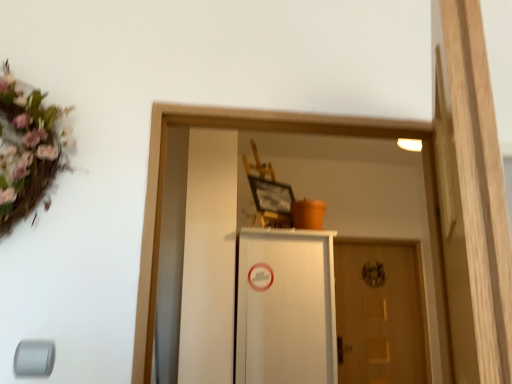
This screenshot has width=512, height=384. What do you see at coordinates (379, 313) in the screenshot?
I see `wooden door at center` at bounding box center [379, 313].

The height and width of the screenshot is (384, 512). What are the coordinates of `wooden door at center` in the screenshot? It's located at (379, 313).

What is the approximate height of wooden door at center?

wooden door at center is 1.24 meters in height.

Find the location of `white matte cabinet at center`. white matte cabinet at center is located at coordinates (286, 307).

What do you see at coordinates (286, 307) in the screenshot?
I see `white matte cabinet at center` at bounding box center [286, 307].

Measure the distance between point (272, 328) and camera.

7.66 feet.

Where is `wooden door at center`? This screenshot has width=512, height=384. wooden door at center is located at coordinates (379, 313).

In the scene shown: Does wooden door at center appear on the left side of white matte cabinet at center?

Incorrect, wooden door at center is not on the left side of white matte cabinet at center.

Between wooden door at center and white matte cabinet at center, which one is positioned in front?

white matte cabinet at center is more forward.

Which is behind, point (380, 362) or point (273, 363)?

The point (380, 362) is more distant.

From the image's perspective, does wooden door at center appear higher than white matte cabinet at center?

No, from the image's perspective, wooden door at center is not over white matte cabinet at center.

From a real-world perspective, relative to white matte cabinet at center, is wooden door at center vertically above or below?

From a real-world perspective, wooden door at center is physically below white matte cabinet at center.

Which object is wider, wooden door at center or white matte cabinet at center?

white matte cabinet at center is wider.

Between wooden door at center and white matte cabinet at center, which one has more height?

With more height is wooden door at center.

Is wooden door at center bigger than white matte cabinet at center?

Actually, wooden door at center might be smaller than white matte cabinet at center.

Is wooden door at center not inside white matte cabinet at center?

Yes, wooden door at center is not within white matte cabinet at center.

Are wooden door at center and white matte cabinet at center far apart?

wooden door at center is far away from white matte cabinet at center.

Is wooden door at center facing away from white matte cabinet at center?

No, wooden door at center is not facing away from white matte cabinet at center.

What's the angular difference between wooden door at center and white matte cabinet at center's facing directions?

They differ by 88 degrees in their facing directions.

Find the location of a particular element. This screenshot has height=384, width=512. cabinetry lying on the left of wooden door at center is located at coordinates (286, 307).

Is white matte cabinet at center at the right side of wooden door at center?

In fact, white matte cabinet at center is to the left of wooden door at center.

Considering the positions of objects white matte cabinet at center and wooden door at center in the image provided, who is in front, white matte cabinet at center or wooden door at center?

white matte cabinet at center is in front.

Which is less distant, (298, 306) or (378, 365)?

Point (298, 306) is closer to the camera than point (378, 365).

From the image's perspective, which one is positioned lower, white matte cabinet at center or wooden door at center?

wooden door at center, from the image's perspective.

From a real-world perspective, which is physically above, white matte cabinet at center or wooden door at center?

From a 3D spatial view, white matte cabinet at center is above.

In the scene shown: Considering the relative sizes of white matte cabinet at center and wooden door at center in the image provided, is white matte cabinet at center thinner than wooden door at center?

No, white matte cabinet at center is not thinner than wooden door at center.

Which of these two, white matte cabinet at center or wooden door at center, stands taller?

With more height is wooden door at center.

Does white matte cabinet at center have a smaller size compared to wooden door at center?

No, white matte cabinet at center is not smaller than wooden door at center.

Is white matte cabinet at center completely or partially outside of wooden door at center?

white matte cabinet at center lies outside wooden door at center's area.

Are white matte cabinet at center and wooden door at center located far from each other?

Yes, white matte cabinet at center is far from wooden door at center.

Is white matte cabinet at center turned away from wooden door at center?

No, white matte cabinet at center's orientation is not away from wooden door at center.

How many degrees apart are the facing directions of white matte cabinet at center and wooden door at center?

88 degrees.

Measure the distance between white matte cabinet at center and wooden door at center.

They are 5.31 feet apart.

This screenshot has width=512, height=384. I want to click on door on the right of white matte cabinet at center, so click(379, 313).

Where is `cabinetry that is above the wooden door at center (from the image's perspective)`? The height and width of the screenshot is (384, 512). cabinetry that is above the wooden door at center (from the image's perspective) is located at coordinates (286, 307).

Locate an element on the screen. cabinetry that appears above the wooden door at center (from a real-world perspective) is located at coordinates (286, 307).